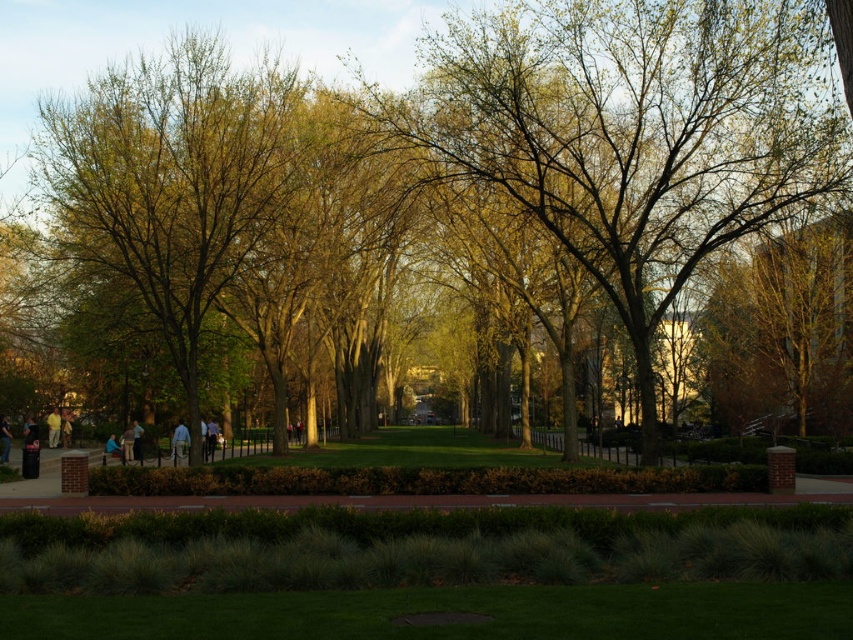
Describe the element at coordinates (53, 428) in the screenshot. I see `yellow cotton shirt at lower left` at that location.

Which is in front, point (57, 422) or point (28, 429)?

Point (28, 429) is in front.

Does point (56, 406) come closer to viewer compared to point (38, 433)?

That is False.

In order to click on yellow cotton shirt at lower left in this screenshot , I will do `click(53, 428)`.

Who is positioned more to the right, yellow cotton shirt at lower left or light blue jeans at lower left?

light blue jeans at lower left

Can you confirm if yellow cotton shirt at lower left is wider than light blue jeans at lower left?

A: In fact, yellow cotton shirt at lower left might be narrower than light blue jeans at lower left.

Describe the element at coordinates (53, 428) in the screenshot. I see `yellow cotton shirt at lower left` at that location.

This screenshot has height=640, width=853. I want to click on yellow cotton shirt at lower left, so click(x=53, y=428).

Between red brick path at center and light blue jeans at lower left, which one appears on the right side from the viewer's perspective?

Positioned to the right is red brick path at center.

Can you confirm if red brick path at center is positioned below light blue jeans at lower left?

No, red brick path at center is not below light blue jeans at lower left.

Identify the location of red brick path at center. (409, 500).